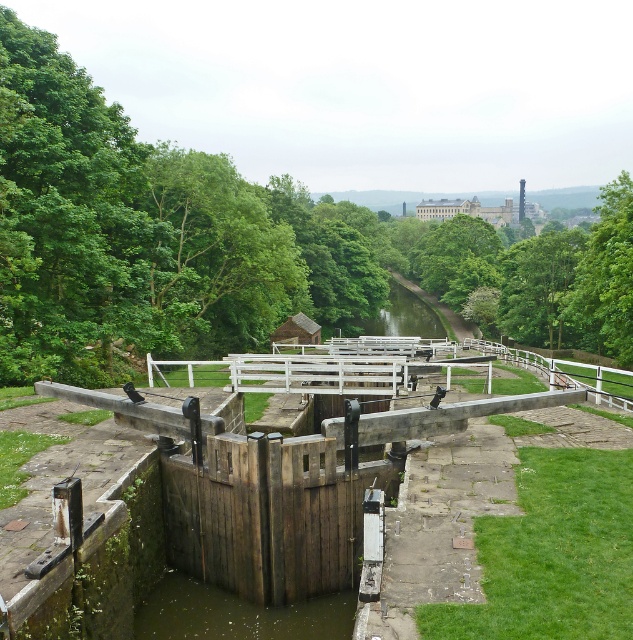
Question: Which point is closer to the camera taking this photo?

Choices:
 (A) (603, 266)
 (B) (463, 305)
 (C) (568, 362)

Answer: (A)

Question: Among these objects, which one is nearest to the camera?

Choices:
 (A) white wooden rail at center-right
 (B) green leafy tree at upper left
 (C) green leafy tree at upper right

Answer: (A)

Question: Is green leafy tree at upper left bigger than white wooden rail at center-right?

Choices:
 (A) yes
 (B) no

Answer: (A)

Question: Is green leafy tree at upper left closer to camera compared to white wooden rail at center-right?

Choices:
 (A) yes
 (B) no

Answer: (B)

Question: Can you confirm if green leafy tree at upper left is positioned to the right of white wooden rail at center-right?

Choices:
 (A) yes
 (B) no

Answer: (B)

Question: Which point is closer to the camera?

Choices:
 (A) (561, 364)
 (B) (587, 328)
 (C) (517, 250)

Answer: (A)